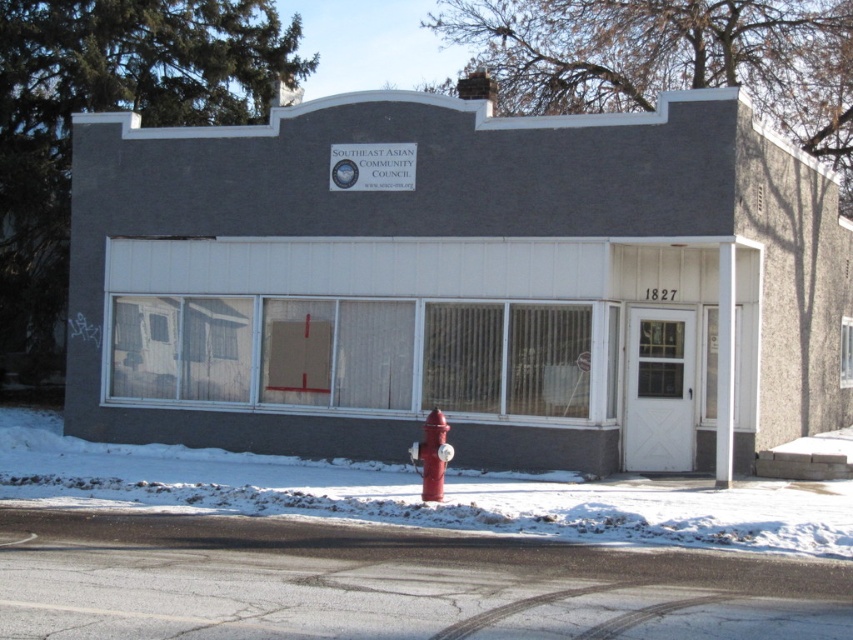
You are standing in front of the Southeast Asian Community Council building and want to locate the white powdery snow at lower center. According to the coordinates provided, where exactly would you find it?

The white powdery snow at lower center is located at coordinates point (418, 493).

You are a delivery person trying to reach the entrance of the Southeast Asian Community Council building. You see the white powdery snow at lower center and the red matte fire hydrant at lower center. Which object is closer to the ground?

The white powdery snow at lower center is closer to the ground because it is below the red matte fire hydrant at lower center.

Consider the image. You are a delivery person who needs to leave your delivery cart at the red matte fire hydrant at lower center. The cart requires a space of 8 feet. Is there enough space between the white powdery snow at lower center and the hydrant to park the cart?

The white powdery snow at lower center is 8.06 feet from the red matte fire hydrant at lower center, so yes, there is enough space to park the cart between them since the distance is slightly more than 8 feet.